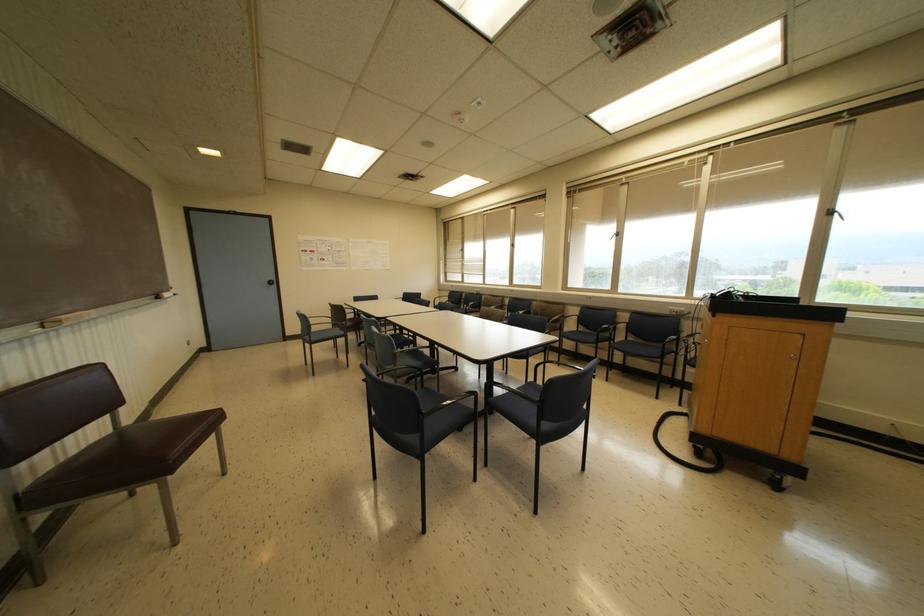
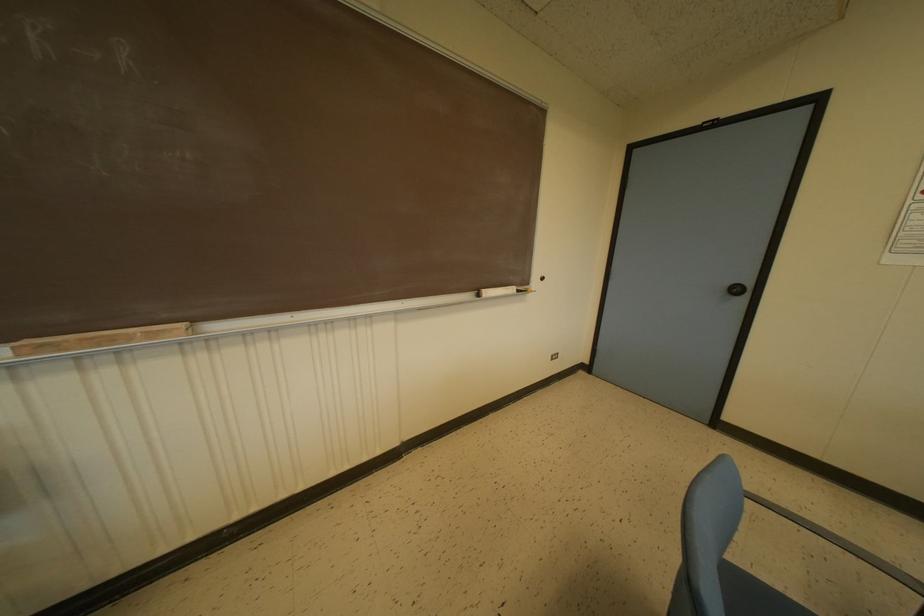
Find the pixel in the second image that matches [274,282] in the first image.

(746, 291)